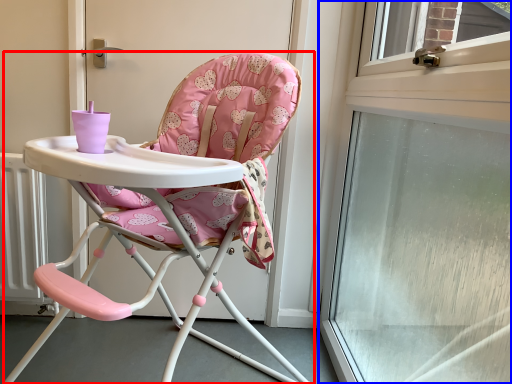
Question: Among these objects, which one is nearest to the camera, chair (highlighted by a red box) or window (highlighted by a blue box)?

Choices:
 (A) chair
 (B) window

Answer: (B)